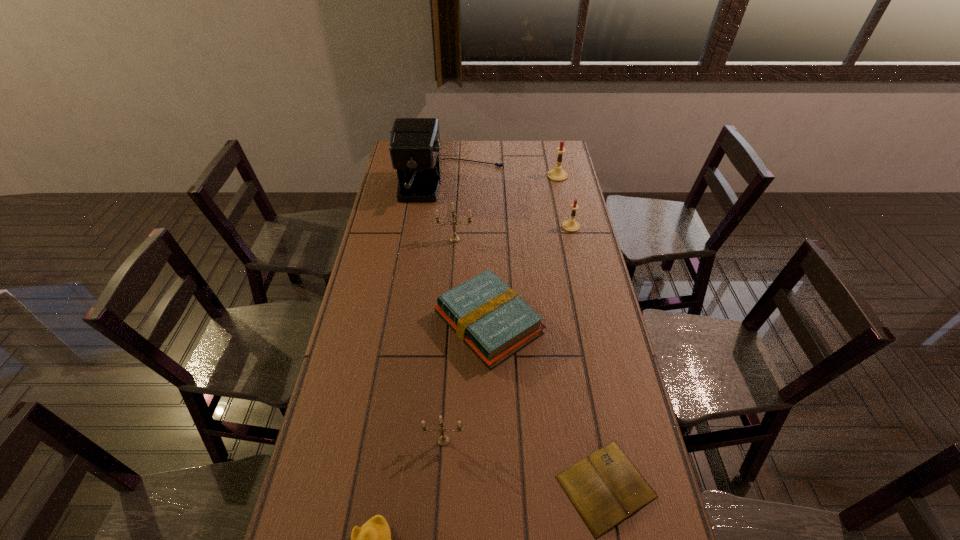
Where is `coffee maker`? coffee maker is located at coordinates (415, 151).

Find the location of a particular element. the tallest object is located at coordinates (415, 151).

The image size is (960, 540). What are the coordinates of `the farthest candle` in the screenshot? It's located at (557, 174).

Identify the location of the bigger red candle. The width and height of the screenshot is (960, 540). (557, 174).

The height and width of the screenshot is (540, 960). In order to click on the bigger metallic candle in this screenshot , I will do `click(454, 238)`.

You are a GUI agent. You are given a task and a screenshot of the screen. Output one action in this format:
    pyautogui.click(x=<x>, y=<y>)
    Task: Click on the farther metallic candle
    
    Given the screenshot: What is the action you would take?
    pyautogui.click(x=454, y=238)

Find the location of a particular element. This screenshot has width=960, height=540. the nearer red candle is located at coordinates (x=571, y=225).

In order to click on the third farthest object in this screenshot , I will do `click(571, 225)`.

Locate an element on the screen. The image size is (960, 540). the nearer metallic candle is located at coordinates (443, 440).

Find the location of `the smaller metallic candle`. the smaller metallic candle is located at coordinates (443, 440).